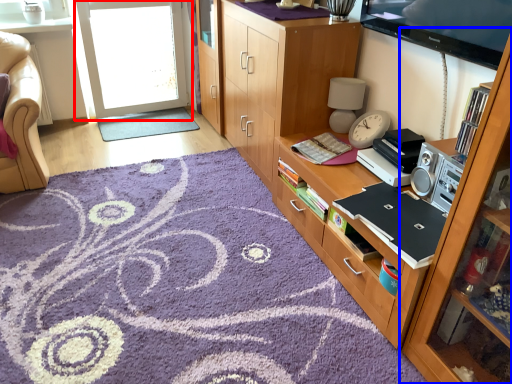
Question: Which object appears closest to the camera in this image, screen door (highlighted by a red box) or cabinetry (highlighted by a blue box)?

Choices:
 (A) screen door
 (B) cabinetry

Answer: (B)